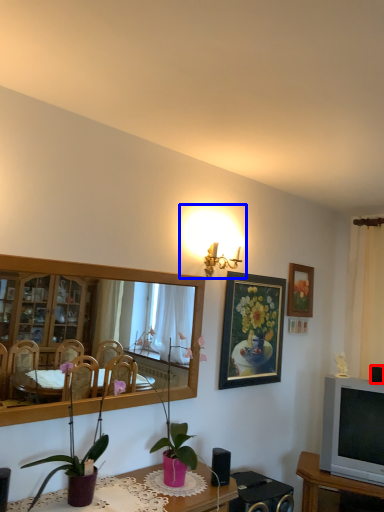
Question: Among these objects, which one is nearest to the camera, speaker (highlighted by a red box) or light fixture (highlighted by a blue box)?

Choices:
 (A) speaker
 (B) light fixture

Answer: (B)